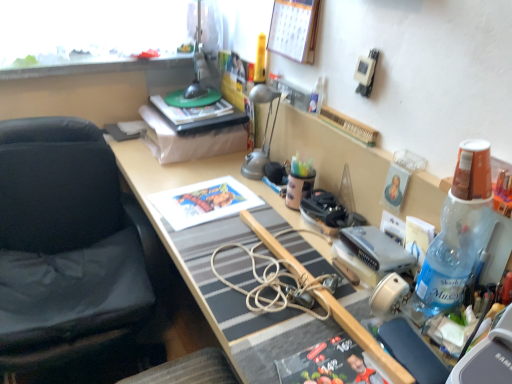
Question: In terms of width, does silver metallic game console at center-right look wider or thinner when compared to wooden calendar at upper center?

Choices:
 (A) wide
 (B) thin

Answer: (A)

Question: Is silver metallic game console at center-right inside the boundaries of wooden calendar at upper center, or outside?

Choices:
 (A) outside
 (B) inside

Answer: (A)

Question: Which object is positioned closest to the silver metallic game console at center-right?

Choices:
 (A) black fabric chair at left
 (B) blue plastic bottle at right
 (C) wooden desk at center
 (D) satin silver lamp at center
 (E) wooden calendar at upper center

Answer: (B)

Question: Considering the real-world distances, which object is farthest from the wooden desk at center?

Choices:
 (A) silver metallic game console at center-right
 (B) matte paper print at center
 (C) wooden calendar at upper center
 (D) blue plastic bottle at right
 (E) hardcover book at center

Answer: (C)